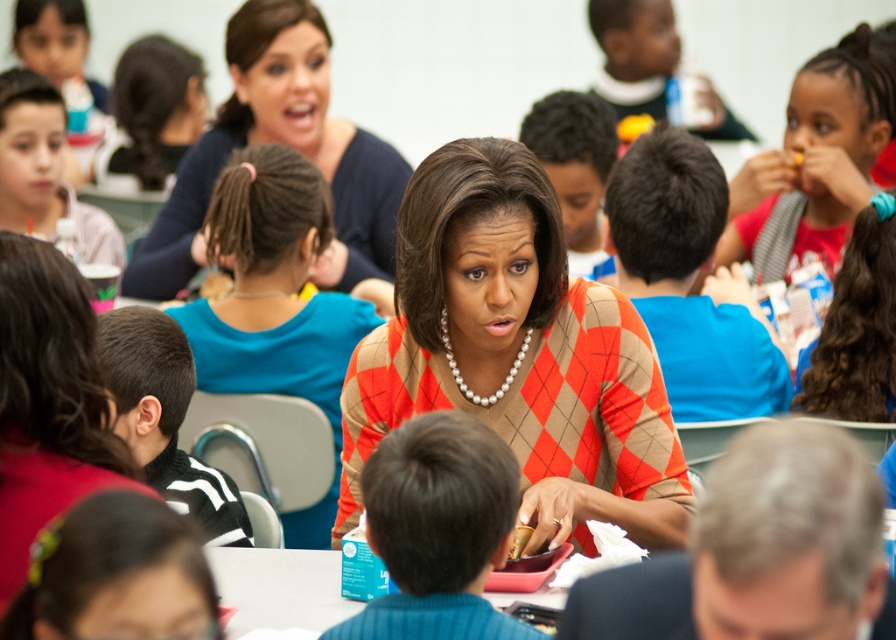
Is matte blue sweater at upper left bigger than blue fabric shirt at center?

Correct, matte blue sweater at upper left is larger in size than blue fabric shirt at center.

Is matte blue sweater at upper left taller than blue fabric shirt at center?

Yes, matte blue sweater at upper left is taller than blue fabric shirt at center.

What do you see at coordinates (279, 141) in the screenshot? The width and height of the screenshot is (896, 640). I see `matte blue sweater at upper left` at bounding box center [279, 141].

The height and width of the screenshot is (640, 896). Identify the location of matte blue sweater at upper left. (279, 141).

Between orange argyle sweater at center and matte blue sweater at upper left, which one appears on the left side from the viewer's perspective?

matte blue sweater at upper left is more to the left.

Does orange argyle sweater at center appear under matte blue sweater at upper left?

Yes, orange argyle sweater at center is below matte blue sweater at upper left.

Who is more forward, [580,525] or [386,220]?

Positioned in front is point [580,525].

This screenshot has width=896, height=640. I want to click on orange argyle sweater at center, so click(x=517, y=353).

Based on the photo, is orange argyle sweater at center to the right of blue plastic table at center from the viewer's perspective?

Correct, you'll find orange argyle sweater at center to the right of blue plastic table at center.

Who is lower down, orange argyle sweater at center or blue plastic table at center?

Positioned lower is blue plastic table at center.

Describe the element at coordinates (517, 353) in the screenshot. I see `orange argyle sweater at center` at that location.

Identify the location of orange argyle sweater at center. (517, 353).